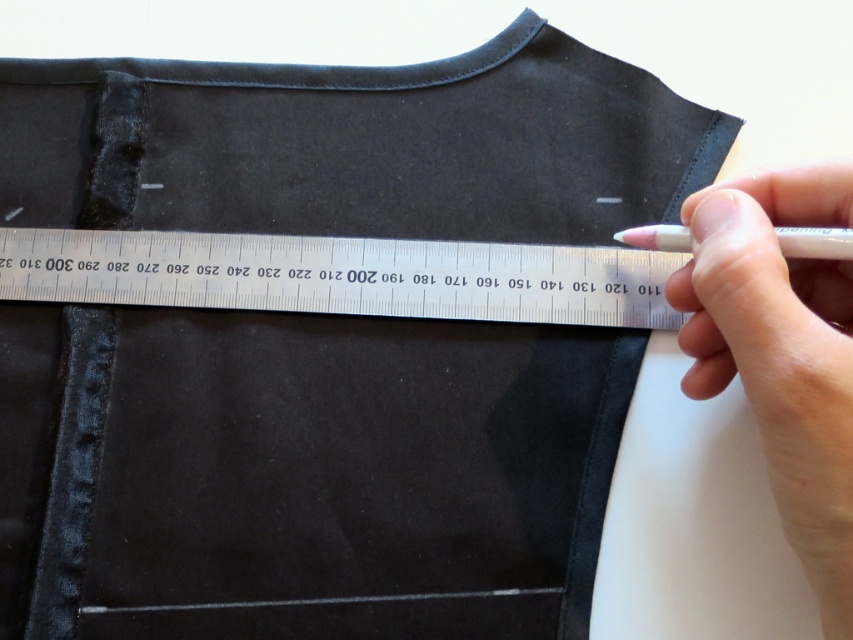
Between metallic silver ruler at center and white matte pen at upper right, which one is positioned lower?

metallic silver ruler at center is lower down.

Is point (842, 259) farther from viewer compared to point (793, 236)?

No, it is in front of (793, 236).

Which is in front, point (55, 237) or point (792, 248)?

Point (792, 248) is in front.

Where is `metallic silver ruler at center`? This screenshot has height=640, width=853. metallic silver ruler at center is located at coordinates (346, 275).

Between metallic silver ruler at center and pink plastic pen at upper right, which one has more height?

With more height is pink plastic pen at upper right.

Between metallic silver ruler at center and pink plastic pen at upper right, which one is positioned higher?

metallic silver ruler at center

This screenshot has width=853, height=640. Identify the location of metallic silver ruler at center. (346, 275).

Find the location of a particular element. This screenshot has width=853, height=640. metallic silver ruler at center is located at coordinates (346, 275).

Which is above, pink plastic pen at upper right or white matte pen at upper right?

Positioned higher is white matte pen at upper right.

Based on the photo, measure the distance from pink plastic pen at upper right to white matte pen at upper right.

2.70 inches

You are a GUI agent. You are given a task and a screenshot of the screen. Output one action in this format:
    pyautogui.click(x=<x>, y=<y>)
    Task: Click on the pink plastic pen at upper right
    The image size is (853, 640).
    Given the screenshot: What is the action you would take?
    pyautogui.click(x=781, y=353)

Find the location of a particular element. pink plastic pen at upper right is located at coordinates (781, 353).